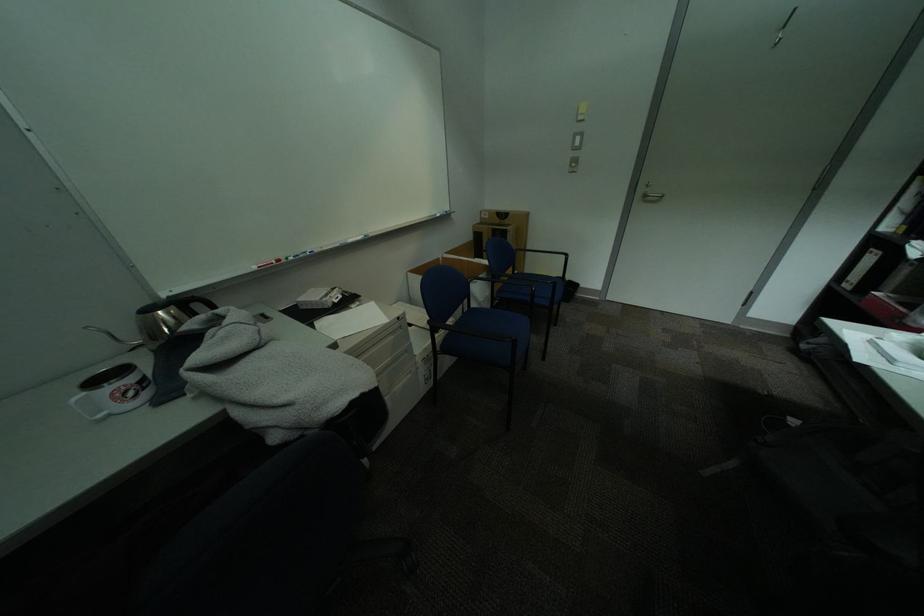
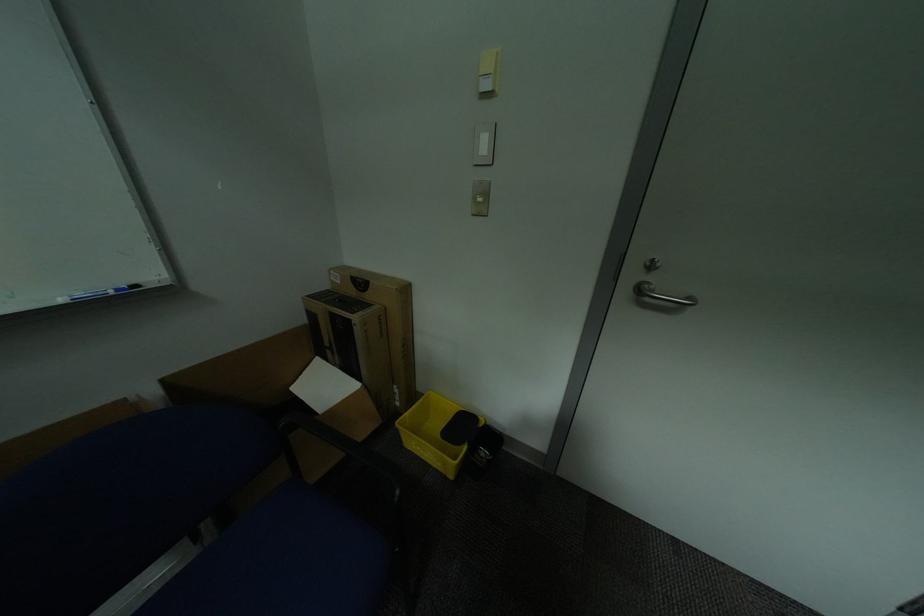
In a continuous first-person perspective shot, in which direction is the camera moving?

The cameraman walked toward right, forward.